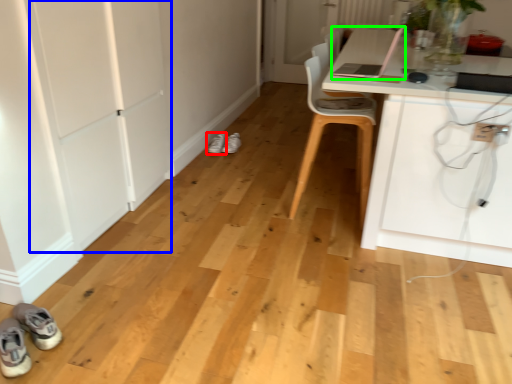
Question: Which object is the closest to the footwear (highlighted by a red box)? Choose among these: door (highlighted by a blue box) or laptop (highlighted by a green box).

Choices:
 (A) door
 (B) laptop

Answer: (A)